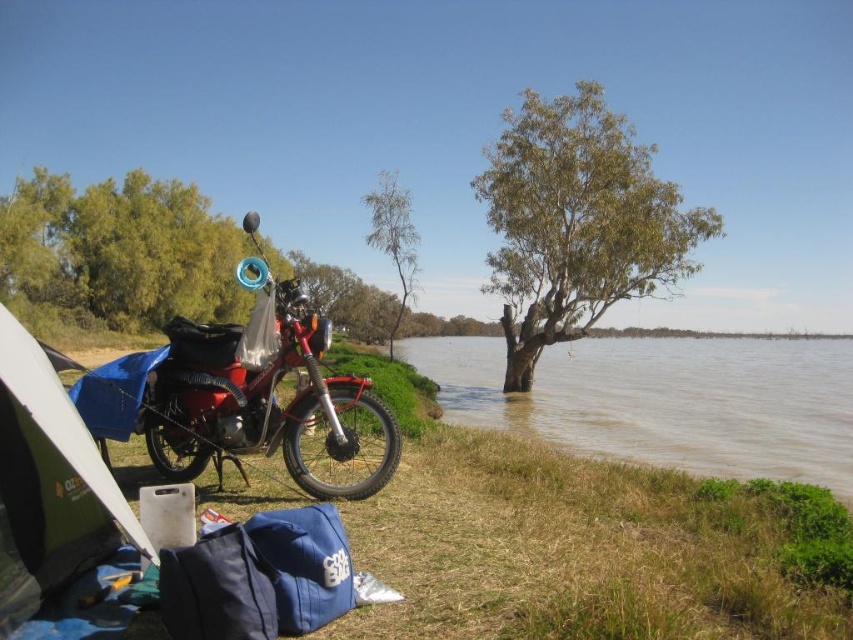
Between shiny red motorcycle at center and bare wood tree at center, which one appears on the left side from the viewer's perspective?

shiny red motorcycle at center is more to the left.

What do you see at coordinates (238, 390) in the screenshot?
I see `shiny red motorcycle at center` at bounding box center [238, 390].

You are a GUI agent. You are given a task and a screenshot of the screen. Output one action in this format:
    pyautogui.click(x=<x>, y=<y>)
    Task: Click on the shiny red motorcycle at center
    This screenshot has width=853, height=640.
    Given the screenshot: What is the action you would take?
    pyautogui.click(x=238, y=390)

Where is `shiny red motorcycle at center`? shiny red motorcycle at center is located at coordinates click(238, 390).

The image size is (853, 640). I want to click on shiny red motorcycle at center, so click(238, 390).

In the scene shown: Can you confirm if shiny red motorcycle at center is shorter than green fabric tent at lower left?

No, shiny red motorcycle at center is not shorter than green fabric tent at lower left.

Where is `shiny red motorcycle at center`? The height and width of the screenshot is (640, 853). shiny red motorcycle at center is located at coordinates (238, 390).

Is shiny red motorcycle at center to the left of green leafy tree at upper left from the viewer's perspective?

No, shiny red motorcycle at center is not to the left of green leafy tree at upper left.

Between shiny red motorcycle at center and green leafy tree at upper left, which one appears on the left side from the viewer's perspective?

Positioned to the left is green leafy tree at upper left.

Is point (270, 422) farther from camera compared to point (163, 224)?

No, (270, 422) is closer to viewer.

I want to click on shiny red motorcycle at center, so click(x=238, y=390).